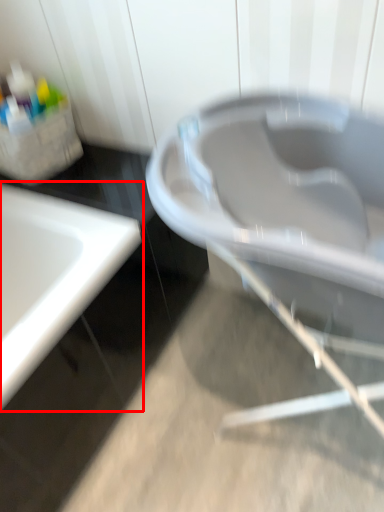
Question: Considering the relative positions of sink (annotated by the red box) and bath in the image provided, where is sink (annotated by the red box) located with respect to the staircase?

Choices:
 (A) left
 (B) right

Answer: (A)